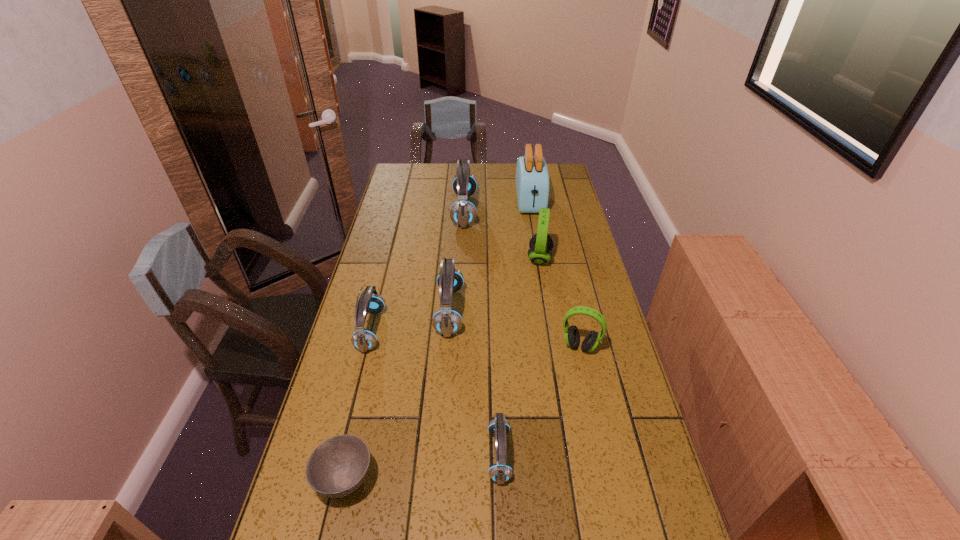
Identify the location of the tallest object. (532, 178).

Where is `toaster`? toaster is located at coordinates (532, 178).

Identify the location of the farthest headset. This screenshot has height=540, width=960. pos(463,213).

Where is `the biggest blue headset`? This screenshot has width=960, height=540. the biggest blue headset is located at coordinates click(x=463, y=213).

Locate an element on the screen. This screenshot has width=960, height=540. the third farthest object is located at coordinates (541, 244).

Locate an element on the screen. The image size is (960, 540). the bigger green headset is located at coordinates (541, 244).

Where is `the second biggest blue headset`? The image size is (960, 540). the second biggest blue headset is located at coordinates (446, 321).

You are a GUI agent. You are given a task and a screenshot of the screen. Output one action in this format:
    pyautogui.click(x=<x>, y=<y>)
    Task: Click on the nearer green headset
    Image resolution: width=960 pixels, height=540 pixels.
    Given the screenshot: What is the action you would take?
    pyautogui.click(x=572, y=338)

I want to click on the second smallest blue headset, so click(363, 339).

You are a GUI agent. You are given a task and a screenshot of the screen. Output one action in this format:
    pyautogui.click(x=<x>, y=<y>)
    Task: Click on the leftmost headset
    
    Given the screenshot: What is the action you would take?
    (x=363, y=339)